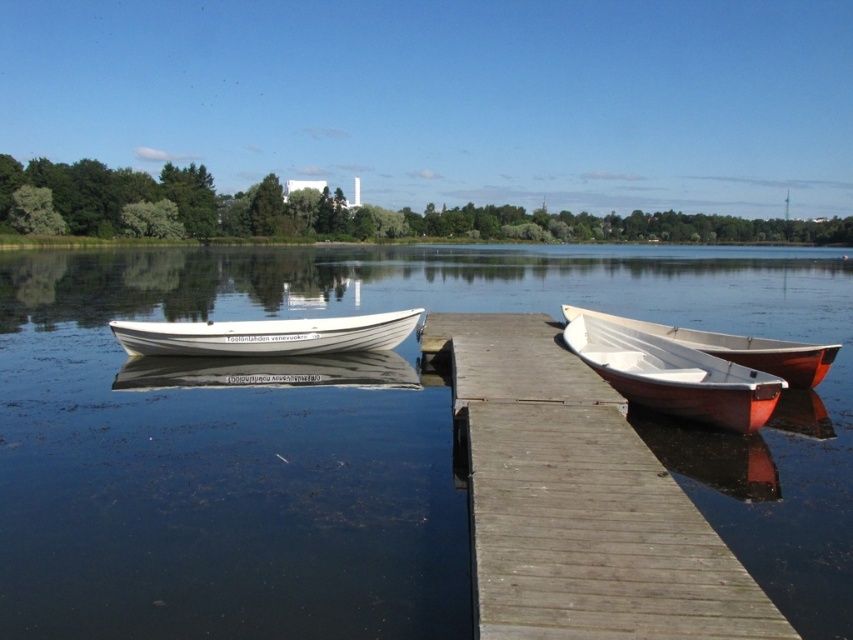
Question: Which of the following is the farthest from the observer?

Choices:
 (A) white wooden boat at center
 (B) white matte canoe at right
 (C) wooden dock at center

Answer: (A)

Question: Which object appears farthest from the camera in this image?

Choices:
 (A) white matte canoe at center
 (B) wooden dock at center
 (C) clear water at dock center

Answer: (A)

Question: Is clear water at dock center bigger than white matte canoe at right?

Choices:
 (A) no
 (B) yes

Answer: (B)

Question: Which of the following is the closest to the observer?

Choices:
 (A) white wooden boat at center
 (B) clear water at dock center
 (C) white matte canoe at right
 (D) wooden dock at center

Answer: (D)

Question: Is clear water at dock center bigger than white wooden boat at center?

Choices:
 (A) no
 (B) yes

Answer: (B)

Question: Does clear water at dock center have a greater width compared to white wooden boat at center?

Choices:
 (A) yes
 (B) no

Answer: (A)